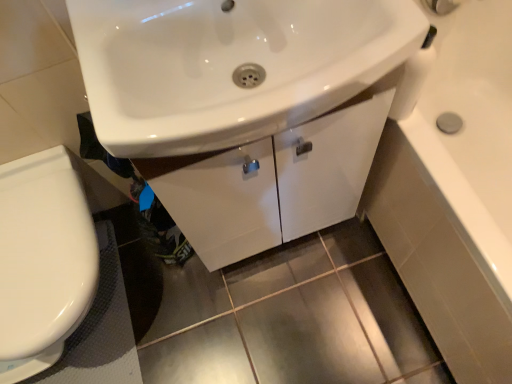
Locate an element on the screen. This screenshot has width=512, height=384. vacant space underneath white glossy toilet at lower left (from a real-world perspective) is located at coordinates (x=104, y=297).